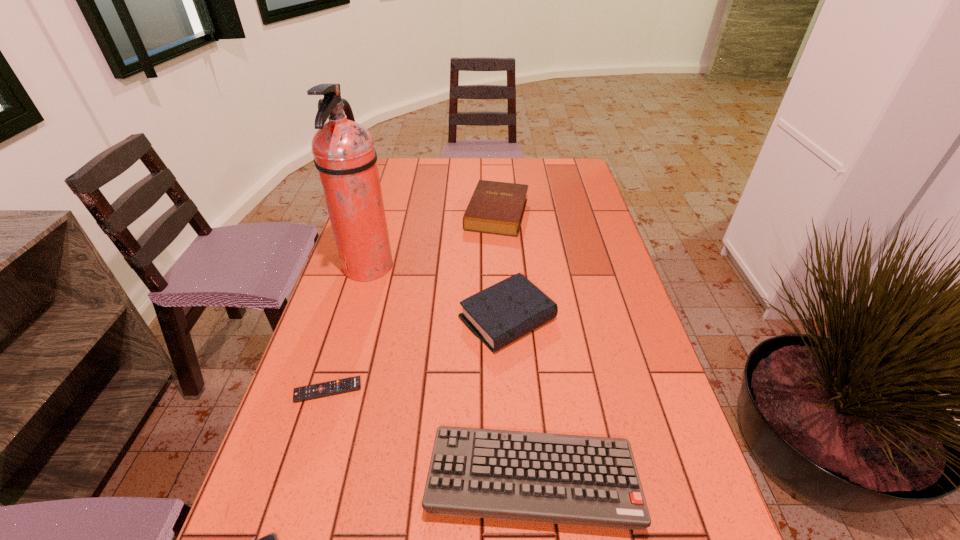
At what (x,y) coordinates should I click in order to perform the action: click on vacant space situated on the right of the third nearest object. Please return your answer as a coordinate pair (x, y). Looking at the image, I should click on (439, 390).

Locate an element on the screen. fire extinguisher positioned at the left edge is located at coordinates (344, 154).

Where is `remote control at the left edge`? Image resolution: width=960 pixels, height=540 pixels. remote control at the left edge is located at coordinates (319, 390).

Image resolution: width=960 pixels, height=540 pixels. What are the coordinates of `object that is at the right edge` in the screenshot? It's located at (499, 474).

Where is `free point at the far edge`? The width and height of the screenshot is (960, 540). free point at the far edge is located at coordinates (467, 174).

In order to click on free location at the left edge of the desktop in this screenshot , I will do `click(332, 303)`.

This screenshot has height=540, width=960. Find the location of `free space at the right edge of the desktop`. free space at the right edge of the desktop is located at coordinates (575, 280).

Identify the location of free space at the far left corner of the desktop. This screenshot has width=960, height=540. (406, 188).

Locate an element on the screen. The image size is (960, 540). vacant space at the far right corner of the desktop is located at coordinates (567, 170).

Image resolution: width=960 pixels, height=540 pixels. In order to click on vacant region between the fire extinguisher and the fifth tallest object in this screenshot , I will do `click(348, 329)`.